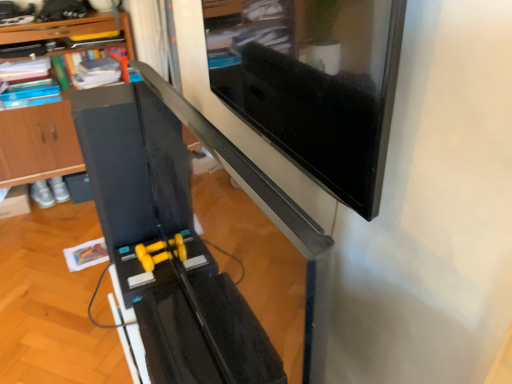
Question: From a real-world perspective, is wooden at left located beneath black glossy computer desk at center?

Choices:
 (A) yes
 (B) no

Answer: (A)

Question: Could you tell me if wooden at left is turned towards black glossy computer desk at center?

Choices:
 (A) yes
 (B) no

Answer: (A)

Question: Can you confirm if wooden at left is positioned to the right of black glossy computer desk at center?

Choices:
 (A) no
 (B) yes

Answer: (A)

Question: Can you confirm if wooden at left is positioned to the left of black glossy computer desk at center?

Choices:
 (A) no
 (B) yes

Answer: (B)

Question: Is there a large distance between wooden at left and black glossy computer desk at center?

Choices:
 (A) yes
 (B) no

Answer: (A)

Question: Considering the relative sizes of wooden at left and black glossy computer desk at center in the image provided, is wooden at left bigger than black glossy computer desk at center?

Choices:
 (A) yes
 (B) no

Answer: (A)

Question: Is black glossy computer desk at center turned away from matte black monitor at upper right?

Choices:
 (A) no
 (B) yes

Answer: (A)

Question: Can you confirm if black glossy computer desk at center is thinner than matte black monitor at upper right?

Choices:
 (A) yes
 (B) no

Answer: (B)

Question: Can you confirm if black glossy computer desk at center is positioned to the left of matte black monitor at upper right?

Choices:
 (A) yes
 (B) no

Answer: (A)

Question: From a real-world perspective, is black glossy computer desk at center positioned under matte black monitor at upper right based on gravity?

Choices:
 (A) no
 (B) yes

Answer: (B)

Question: From the image's perspective, would you say black glossy computer desk at center is shown under matte black monitor at upper right?

Choices:
 (A) no
 (B) yes

Answer: (B)

Question: From the image's perspective, is black glossy computer desk at center above matte black monitor at upper right?

Choices:
 (A) yes
 (B) no

Answer: (B)

Question: From a real-world perspective, is wooden at left located beneath matte black monitor at upper right?

Choices:
 (A) yes
 (B) no

Answer: (A)